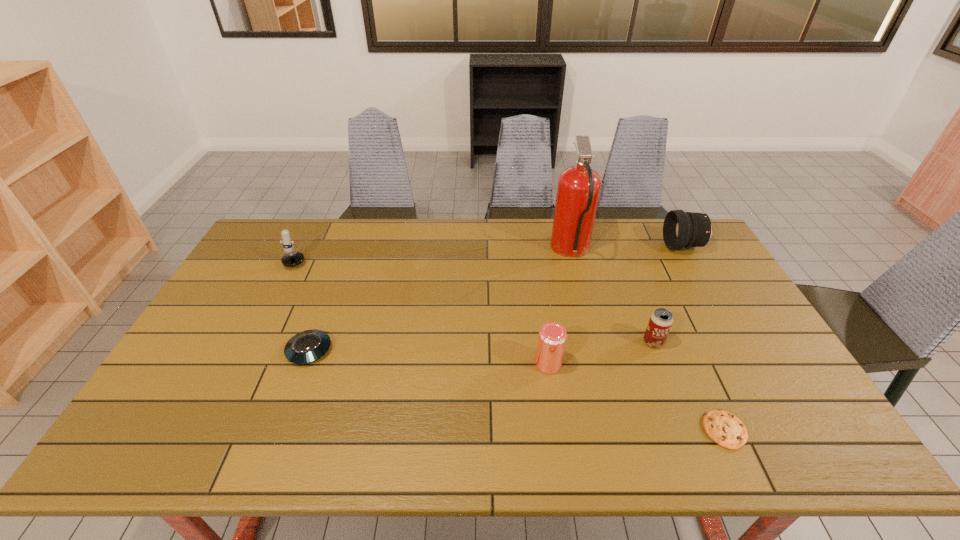
Locate an element on the screen. object positioned at the far right corner is located at coordinates (681, 229).

Find the location of a particular element. The height and width of the screenshot is (540, 960). vacant space at the far edge is located at coordinates (495, 241).

Find the location of `blank space at the near edge of the desktop`. blank space at the near edge of the desktop is located at coordinates (342, 459).

You are a GUI agent. You are given a task and a screenshot of the screen. Output one action in this format:
    pyautogui.click(x=<x>, y=<y>)
    Task: Click on the free space at the left edge
    Image resolution: width=960 pixels, height=540 pixels.
    Given the screenshot: What is the action you would take?
    (x=209, y=349)

This screenshot has height=540, width=960. I want to click on vacant area at the right edge of the desktop, so click(757, 337).

Find the location of a particular element. The width and height of the screenshot is (960, 540). free space between the microphone and the tallest object is located at coordinates (435, 253).

This screenshot has width=960, height=540. Find the location of `empty space between the third object from right to left and the fourth object from left to right`. empty space between the third object from right to left and the fourth object from left to right is located at coordinates (612, 296).

I want to click on free space between the second object from left to right and the right beer can, so click(x=481, y=346).

Find the location of a particular element. The image size is (960, 540). vacant area that lies between the fourth object from left to right and the telephoto lens is located at coordinates (627, 248).

This screenshot has width=960, height=540. Find the location of `free space between the second shortest object and the fire extinguisher`. free space between the second shortest object and the fire extinguisher is located at coordinates (440, 301).